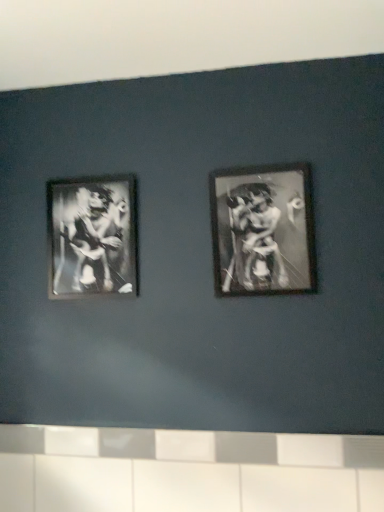
Question: In terms of size, does white glossy tile at lower center appear bigger or smaller than metallic silver frame at center right, which ranks as the 1th picture frame in right-to-left order?

Choices:
 (A) small
 (B) big

Answer: (B)

Question: Based on their positions, is white glossy tile at lower center located to the left or right of metallic silver frame at center right, arranged as the first picture frame when viewed from the front?

Choices:
 (A) left
 (B) right

Answer: (A)

Question: Considering the real-world distances, which object is closest to the metallic silver frame at left, marked as the 1th picture frame in a left-to-right arrangement?

Choices:
 (A) white glossy tile at lower center
 (B) metallic silver frame at center right, which ranks as the 2th picture frame in back-to-front order

Answer: (B)

Question: Considering the real-world distances, which object is farthest from the white glossy tile at lower center?

Choices:
 (A) metallic silver frame at left, which appears as the first picture frame when viewed from the back
 (B) metallic silver frame at center right, the 2th picture frame viewed from the left

Answer: (A)